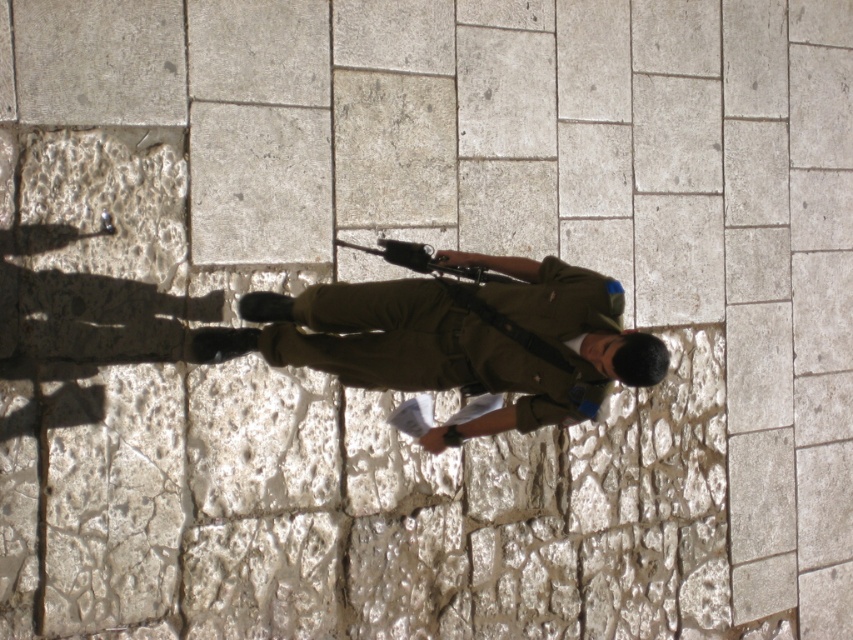
Question: Is olive green uniform at center closer to camera compared to polished metal rifle at center?

Choices:
 (A) no
 (B) yes

Answer: (B)

Question: Among these points, which one is farthest from the camera?

Choices:
 (A) (410, 268)
 (B) (317, 296)

Answer: (A)

Question: Does olive green uniform at center come in front of polished metal rifle at center?

Choices:
 (A) no
 (B) yes

Answer: (B)

Question: Observing the image, what is the correct spatial positioning of olive green uniform at center in reference to polished metal rifle at center?

Choices:
 (A) below
 (B) above

Answer: (A)

Question: Which point appears closest to the camera in this image?

Choices:
 (A) (576, 301)
 (B) (384, 244)

Answer: (A)